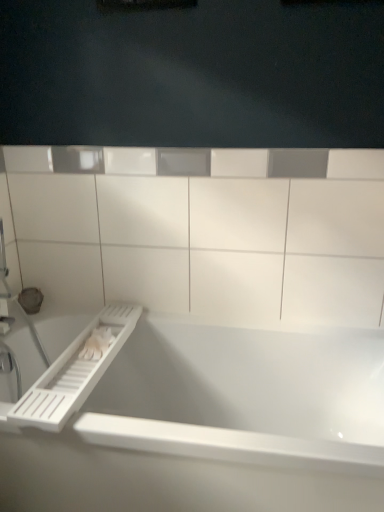
Question: Should I look upward or downward to see white glossy bathtub at center?

Choices:
 (A) down
 (B) up

Answer: (A)

Question: Considering the relative sizes of white plastic ledge at upper center and white glossy bathtub at center in the image provided, is white plastic ledge at upper center smaller than white glossy bathtub at center?

Choices:
 (A) no
 (B) yes

Answer: (B)

Question: Can you confirm if white plastic ledge at upper center is shorter than white glossy bathtub at center?

Choices:
 (A) yes
 (B) no

Answer: (B)

Question: Is there a large distance between white plastic ledge at upper center and white glossy bathtub at center?

Choices:
 (A) no
 (B) yes

Answer: (A)

Question: From a real-world perspective, is white plastic ledge at upper center below white glossy bathtub at center?

Choices:
 (A) yes
 (B) no

Answer: (B)

Question: Considering the relative sizes of white plastic ledge at upper center and white glossy bathtub at center in the image provided, is white plastic ledge at upper center thinner than white glossy bathtub at center?

Choices:
 (A) no
 (B) yes

Answer: (B)

Question: From the image's perspective, is white plastic ledge at upper center below white glossy bathtub at center?

Choices:
 (A) no
 (B) yes

Answer: (A)

Question: Would you say white plastic towel bar at lower left contains white glossy bathtub at center?

Choices:
 (A) yes
 (B) no

Answer: (B)

Question: Is white plastic towel bar at lower left placed right next to white glossy bathtub at center?

Choices:
 (A) no
 (B) yes

Answer: (A)

Question: Is the depth of white plastic towel bar at lower left greater than that of white glossy bathtub at center?

Choices:
 (A) yes
 (B) no

Answer: (A)

Question: Is white plastic towel bar at lower left bigger than white glossy bathtub at center?

Choices:
 (A) no
 (B) yes

Answer: (A)

Question: Does white plastic towel bar at lower left appear on the right side of white glossy bathtub at center?

Choices:
 (A) yes
 (B) no

Answer: (B)

Question: Considering the relative sizes of white plastic towel bar at lower left and white glossy bathtub at center in the image provided, is white plastic towel bar at lower left shorter than white glossy bathtub at center?

Choices:
 (A) yes
 (B) no

Answer: (A)

Question: Does white glossy bathtub at center have a greater height compared to white plastic ledge at upper center?

Choices:
 (A) no
 (B) yes

Answer: (A)